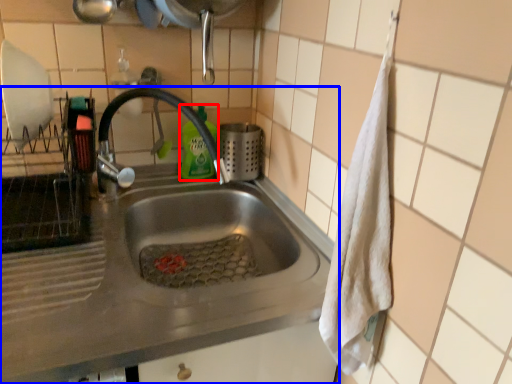
Question: Which of the following is the closest to the observer, cleaning product (highlighted by a red box) or sink (highlighted by a blue box)?

Choices:
 (A) cleaning product
 (B) sink

Answer: (B)